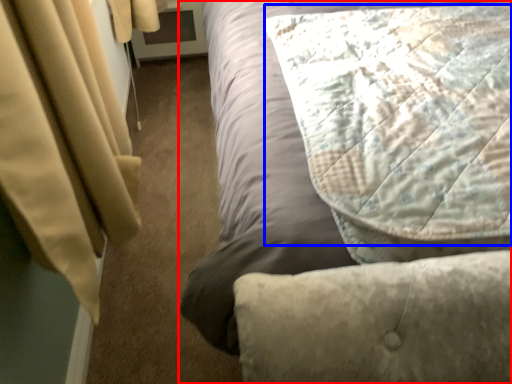
Question: Among these objects, which one is farthest to the camera, bed (highlighted by a red box) or pillow (highlighted by a blue box)?

Choices:
 (A) bed
 (B) pillow

Answer: (B)